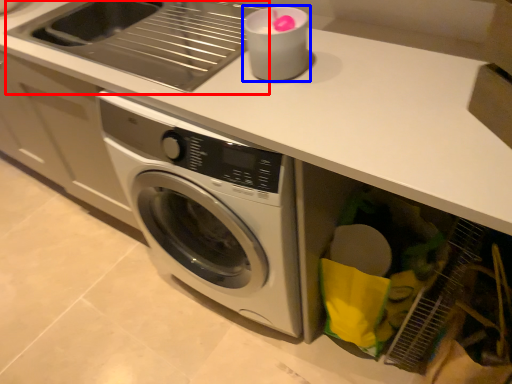
Question: Which point is closer to the camera, sink (highlighted by a red box) or appliance (highlighted by a blue box)?

Choices:
 (A) sink
 (B) appliance

Answer: (B)